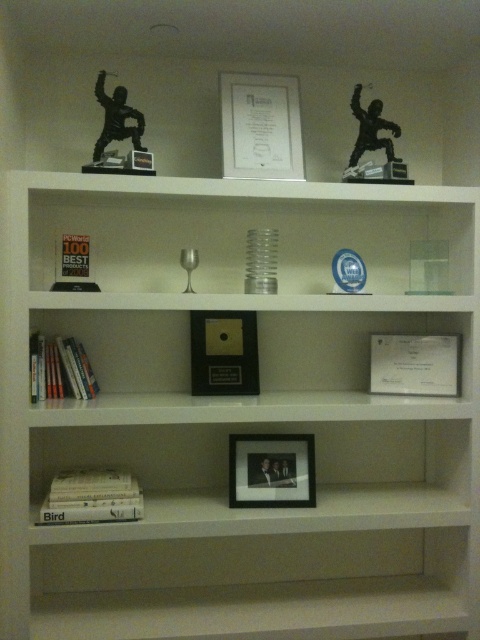
Question: Which object is closer to the camera taking this photo?

Choices:
 (A) white glossy bookshelf at upper center
 (B) metallic gold picture frame at center
 (C) matte black frame at center

Answer: (A)

Question: Estimate the real-world distances between objects in this image. Which object is farther from the hardcover books at lower left?

Choices:
 (A) white matte book at lower left
 (B) matte black frame at center
 (C) metallic gold picture frame at center
 (D) white glossy bookshelf at upper center

Answer: (B)

Question: Can you confirm if metallic gold picture frame at center is wider than white matte book at lower left?

Choices:
 (A) yes
 (B) no

Answer: (B)

Question: Estimate the real-world distances between objects in this image. Which object is closer to the white glossy bookshelf at upper center?

Choices:
 (A) hardcover books at lower left
 (B) metallic gold picture frame at center
 (C) white matte book at lower left

Answer: (B)

Question: Does white glossy bookshelf at upper center have a larger size compared to matte black frame at center?

Choices:
 (A) no
 (B) yes

Answer: (B)

Question: Considering the relative positions of white glossy bookshelf at upper center and hardcover books at lower left in the image provided, where is white glossy bookshelf at upper center located with respect to hardcover books at lower left?

Choices:
 (A) left
 (B) right

Answer: (B)